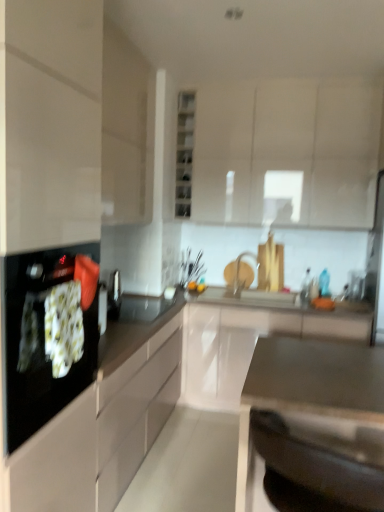
Question: Can you confirm if white glossy cabinet at center, the 1th cabinetry positioned from the bottom, is taller than black glass cooktop at left?

Choices:
 (A) yes
 (B) no

Answer: (A)

Question: Is white glossy cabinet at center, the 1th cabinetry positioned from the bottom, shorter than black glass cooktop at left?

Choices:
 (A) no
 (B) yes

Answer: (A)

Question: Would you consider white glossy cabinet at center, placed as the third cabinetry when sorted from top to bottom, to be distant from black glass cooktop at left?

Choices:
 (A) yes
 (B) no

Answer: (A)

Question: Is white glossy cabinet at center, placed as the third cabinetry when sorted from top to bottom, to the right of black glass cooktop at left from the viewer's perspective?

Choices:
 (A) yes
 (B) no

Answer: (A)

Question: Is white glossy cabinet at center, the 1th cabinetry positioned from the bottom, bigger than black glass cooktop at left?

Choices:
 (A) yes
 (B) no

Answer: (A)

Question: Considering the positions of point coord(51,448) and point coord(322,177), is point coord(51,448) closer or farther from the camera than point coord(322,177)?

Choices:
 (A) closer
 (B) farther

Answer: (A)

Question: Visually, is black glossy countertop at center, placed as the second countertop when sorted from front to back, positioned to the left or to the right of white glossy cabinet at upper center, the first cabinetry from the top?

Choices:
 (A) right
 (B) left

Answer: (B)

Question: Based on their sizes in the image, would you say black glossy countertop at center, placed as the second countertop when sorted from front to back, is bigger or smaller than white glossy cabinet at upper center, the first cabinetry from the top?

Choices:
 (A) small
 (B) big

Answer: (B)

Question: Looking at their shapes, would you say black glossy countertop at center, positioned as the first countertop in back-to-front order, is wider or thinner than white glossy cabinet at upper center, the first cabinetry from the top?

Choices:
 (A) wide
 (B) thin

Answer: (A)

Question: Would you say matte white cabinet at upper left, the second cabinetry in the bottom-to-top sequence, is to the left or to the right of black glass cooktop at left in the picture?

Choices:
 (A) left
 (B) right

Answer: (B)

Question: Relative to black glass cooktop at left, is matte white cabinet at upper left, which is the 2th cabinetry in top-to-bottom order, in front or behind?

Choices:
 (A) behind
 (B) front

Answer: (A)

Question: Is matte white cabinet at upper left, the second cabinetry in the bottom-to-top sequence, wider or thinner than black glass cooktop at left?

Choices:
 (A) wide
 (B) thin

Answer: (B)

Question: Is matte white cabinet at upper left, which is the 2th cabinetry in top-to-bottom order, inside or outside of black glass cooktop at left?

Choices:
 (A) inside
 (B) outside

Answer: (B)

Question: In terms of height, does satin metallic sink at lower center, which is the second countertop from back to front, look taller or shorter compared to black glossy countertop at center, positioned as the first countertop in back-to-front order?

Choices:
 (A) short
 (B) tall

Answer: (A)

Question: Is satin metallic sink at lower center, which is the second countertop from back to front, bigger or smaller than black glossy countertop at center, placed as the second countertop when sorted from front to back?

Choices:
 (A) small
 (B) big

Answer: (A)